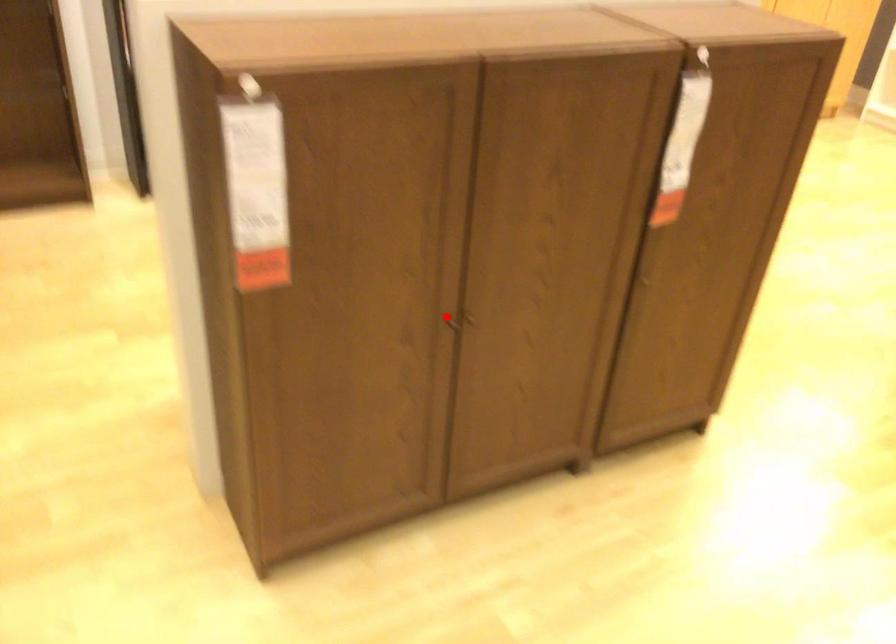
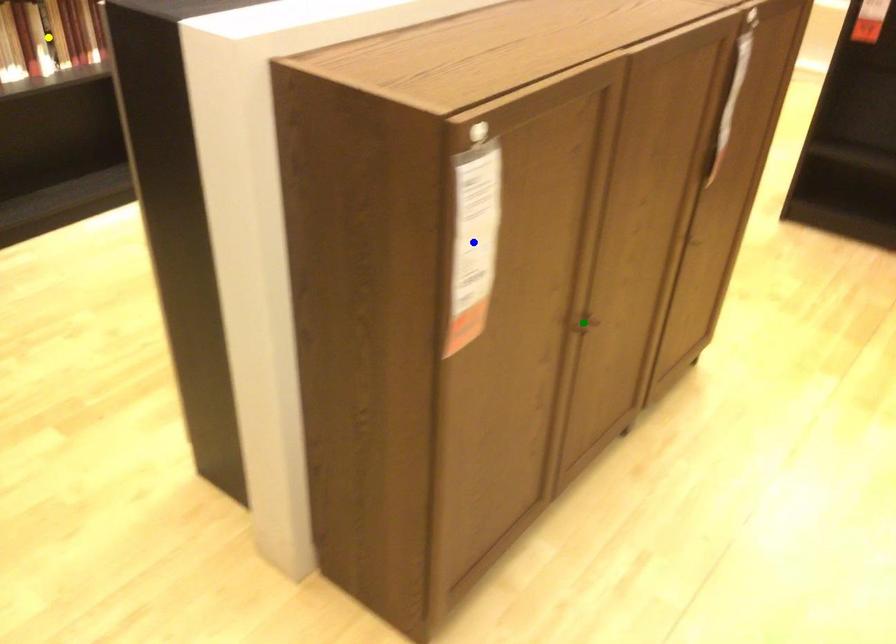
Question: I am providing you with two images of the same scene from different viewpoints. A red point is marked on the first image. You are given multiple points on the second image. In image 2, which mark is for the same physical point as the one in image 1?

Choices:
 (A) blue point
 (B) green point
 (C) yellow point

Answer: (B)